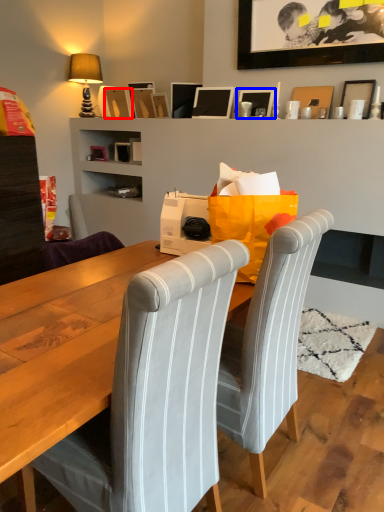
Question: Which of the following is the closest to the observer, picture frame (highlighted by a red box) or picture frame (highlighted by a blue box)?

Choices:
 (A) picture frame
 (B) picture frame

Answer: (B)